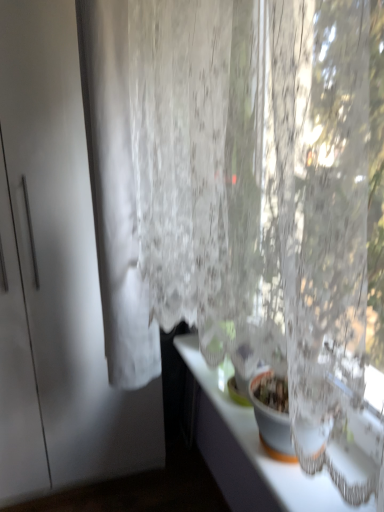
Question: Would you say white glossy counter top at lower right is outside white sheer curtain at left?

Choices:
 (A) yes
 (B) no

Answer: (A)

Question: Is white glossy counter top at lower right at the left side of white sheer curtain at left?

Choices:
 (A) yes
 (B) no

Answer: (B)

Question: Is white glossy counter top at lower right shorter than white sheer curtain at left?

Choices:
 (A) no
 (B) yes

Answer: (B)

Question: Can you confirm if white glossy counter top at lower right is bigger than white sheer curtain at left?

Choices:
 (A) no
 (B) yes

Answer: (A)

Question: From the image's perspective, would you say white glossy counter top at lower right is positioned over white sheer curtain at left?

Choices:
 (A) yes
 (B) no

Answer: (B)

Question: Does white glossy counter top at lower right have a lesser width compared to white sheer curtain at left?

Choices:
 (A) no
 (B) yes

Answer: (A)

Question: Can you confirm if white sheer curtain at left is bigger than white glossy counter top at lower right?

Choices:
 (A) no
 (B) yes

Answer: (B)

Question: Considering the relative positions of white sheer curtain at left and white glossy counter top at lower right in the image provided, is white sheer curtain at left to the left of white glossy counter top at lower right from the viewer's perspective?

Choices:
 (A) yes
 (B) no

Answer: (A)

Question: Is white sheer curtain at left facing towards white glossy counter top at lower right?

Choices:
 (A) no
 (B) yes

Answer: (A)

Question: From the image's perspective, is white sheer curtain at left under white glossy counter top at lower right?

Choices:
 (A) no
 (B) yes

Answer: (A)

Question: Would you say white glossy counter top at lower right is part of white sheer curtain at left's contents?

Choices:
 (A) no
 (B) yes

Answer: (A)

Question: Does white sheer curtain at left come behind white glossy counter top at lower right?

Choices:
 (A) yes
 (B) no

Answer: (A)

Question: From the image's perspective, is white matte screen door at left beneath white glossy counter top at lower right?

Choices:
 (A) yes
 (B) no

Answer: (B)